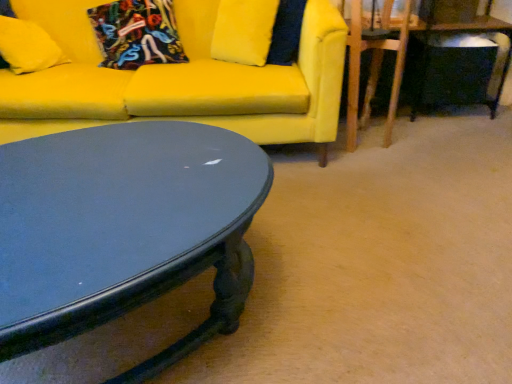
I want to click on vacant space to the right of glossy dark wood coffee table at lower left, so click(x=366, y=262).